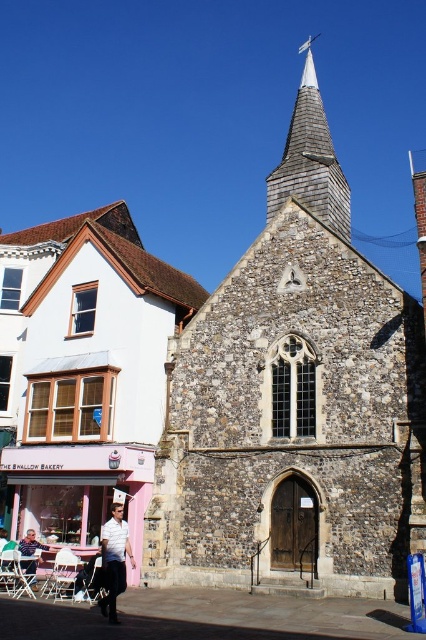
You are standing in the urban scene and need to locate the shiny gray shingles at upper center. According to the scene description, where exactly would you find them?

The shiny gray shingles at upper center are located at the coordinates point (310, 161).